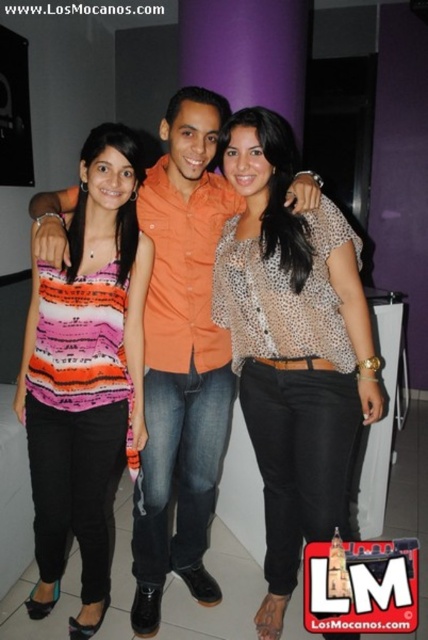
Question: Does leopard print blouse at center appear on the left side of orange cotton shirt at center?

Choices:
 (A) yes
 (B) no

Answer: (B)

Question: Estimate the real-world distances between objects in this image. Which object is closer to the striped fabric top at center?

Choices:
 (A) leopard print blouse at center
 (B) orange cotton shirt at center

Answer: (B)

Question: Which point is farther to the camera?

Choices:
 (A) (255, 355)
 (B) (119, 429)

Answer: (A)

Question: Estimate the real-world distances between objects in this image. Which object is closer to the leopard print blouse at center?

Choices:
 (A) striped fabric top at center
 (B) orange cotton shirt at center

Answer: (B)

Question: Can you confirm if leopard print blouse at center is positioned above striped fabric top at center?

Choices:
 (A) no
 (B) yes

Answer: (B)

Question: Is leopard print blouse at center below striped fabric top at center?

Choices:
 (A) no
 (B) yes

Answer: (A)